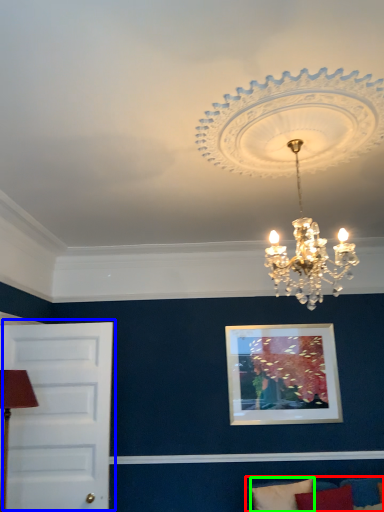
Question: Based on their relative distances, which object is farther from couch (highlighted by a red box)? Choose from door (highlighted by a blue box) and pillow (highlighted by a green box).

Choices:
 (A) door
 (B) pillow

Answer: (A)